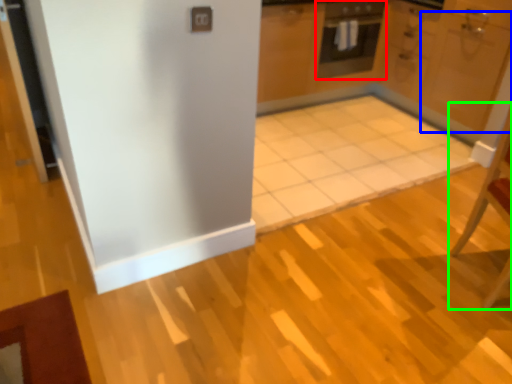
Question: Estimate the real-world distances between objects in this image. Which object is farther from oven (highlighted by a red box), door (highlighted by a blue box) or chair (highlighted by a green box)?

Choices:
 (A) door
 (B) chair

Answer: (B)